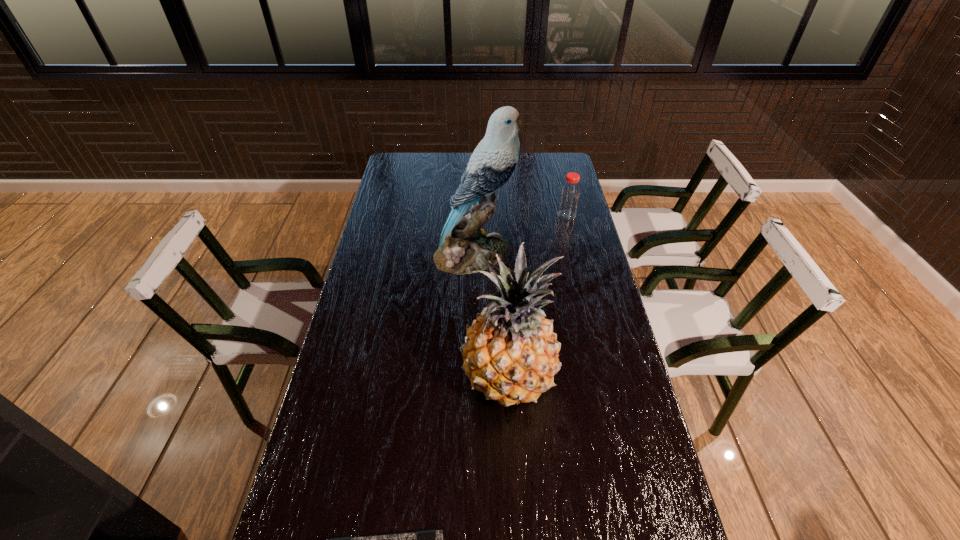
Locate an element on the screen. vacant space that satisfies the following two spatial constraints: 1. on the face of the second farthest object; 2. on the back side of the third farthest object is located at coordinates (472, 378).